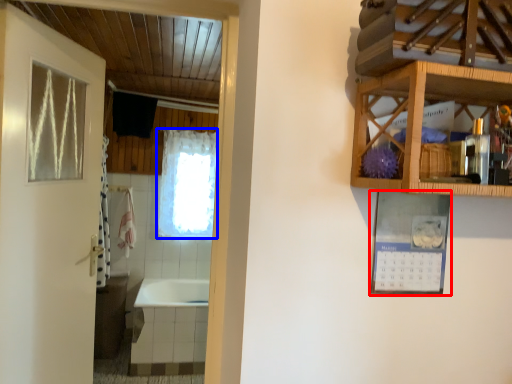
Question: Which point is further to the camera, picture frame (highlighted by a red box) or curtain (highlighted by a blue box)?

Choices:
 (A) picture frame
 (B) curtain

Answer: (B)